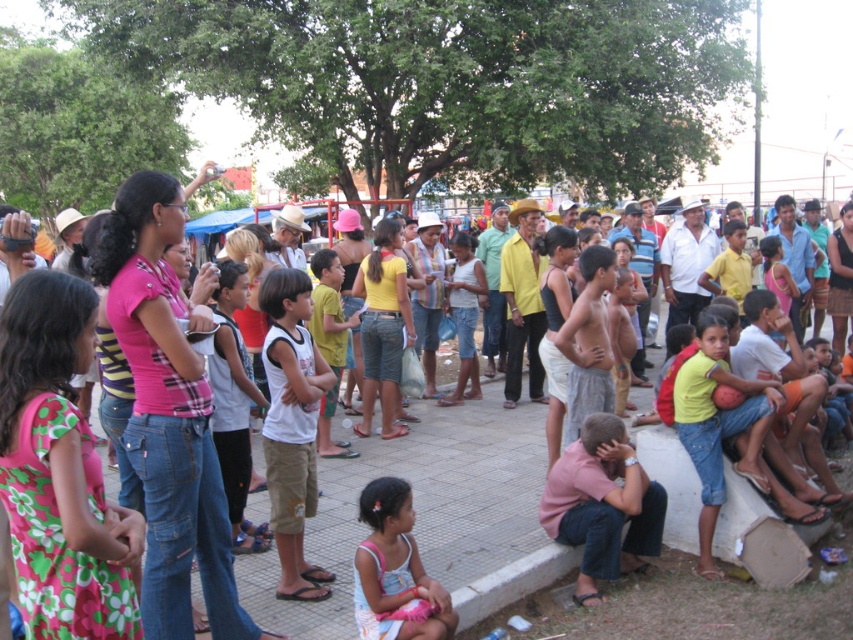
Is jeans at center wider than white cotton tank top at center?

Indeed, jeans at center has a greater width compared to white cotton tank top at center.

Who is more distant from viewer, (259, 513) or (299, 504)?

Positioned behind is point (259, 513).

Identify the location of jeans at center. (431, 516).

Who is more forward, (308, 349) or (701, 352)?

Point (308, 349) is in front.

This screenshot has height=640, width=853. Describe the element at coordinates (292, 426) in the screenshot. I see `white cotton tank top at center` at that location.

Where is `white cotton tank top at center`? white cotton tank top at center is located at coordinates (292, 426).

Does point (653, 428) lie behind point (741, 468)?

Yes, point (653, 428) is farther from viewer.

This screenshot has width=853, height=640. What do you see at coordinates (431, 516) in the screenshot? I see `jeans at center` at bounding box center [431, 516].

Which is in front, point (450, 582) or point (706, 509)?

Point (450, 582)

Where is `jeans at center`? The width and height of the screenshot is (853, 640). jeans at center is located at coordinates (431, 516).